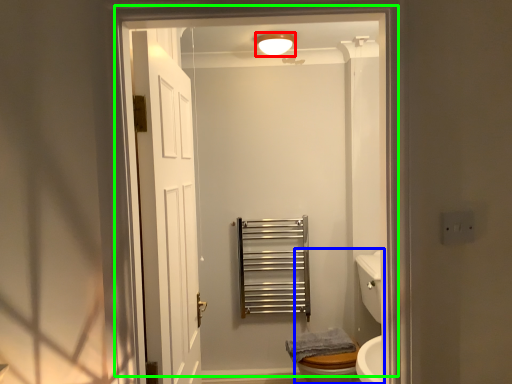
Question: Which object is the farthest from light fixture (highlighted by a red box)? Choose among these: sink (highlighted by a blue box) or door (highlighted by a green box).

Choices:
 (A) sink
 (B) door

Answer: (B)